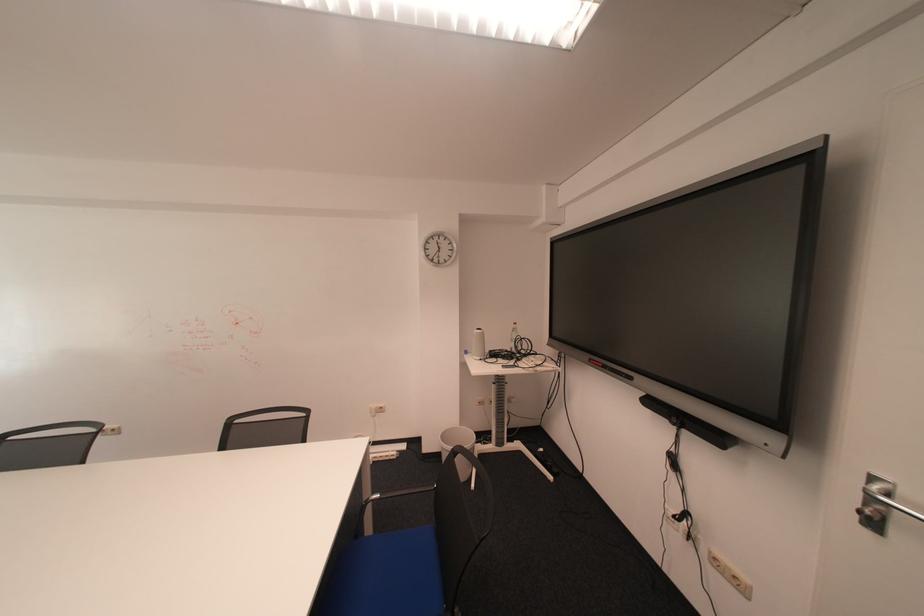
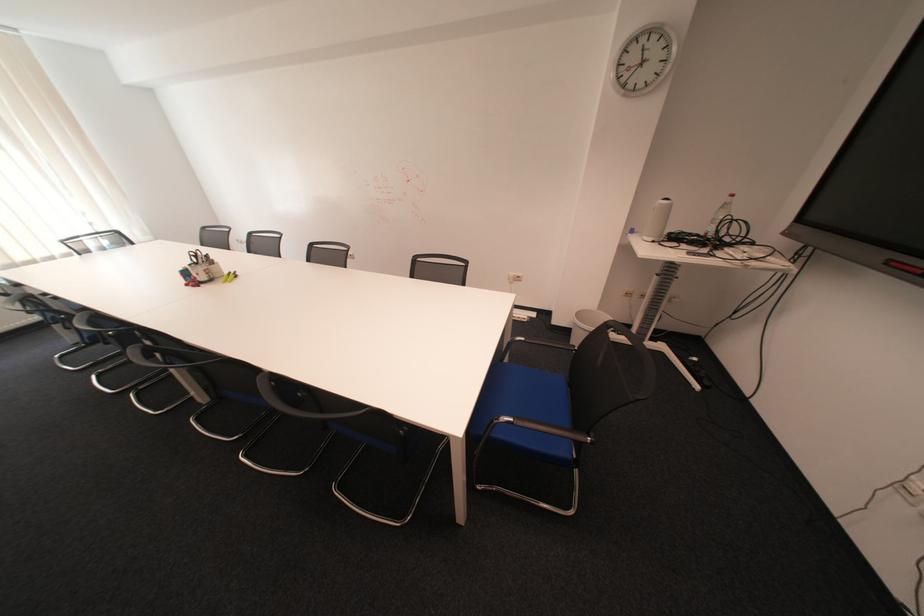
Based on the continuous images, in which direction is the camera rotating?

The camera rotated toward left-down.